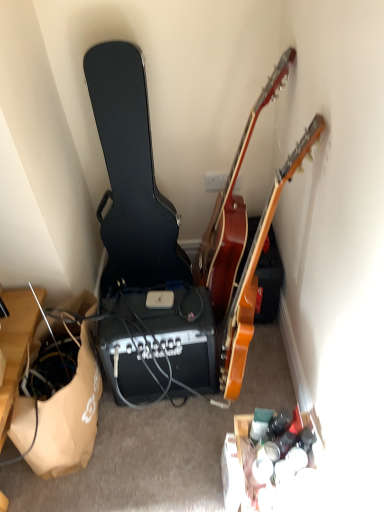
Question: Is glossy wood guitar at upper right, acting as the second guitar starting from the right, further to the viewer compared to brown paper bag at lower left?

Choices:
 (A) yes
 (B) no

Answer: (B)

Question: Could brown paper bag at lower left be considered to be inside glossy wood guitar at upper right, acting as the second guitar starting from the right?

Choices:
 (A) yes
 (B) no

Answer: (B)

Question: Is glossy wood guitar at upper right, which is counted as the 2th guitar, starting from the left, closer to camera compared to brown paper bag at lower left?

Choices:
 (A) no
 (B) yes

Answer: (B)

Question: From the image's perspective, does glossy wood guitar at upper right, which is counted as the 2th guitar, starting from the left, appear higher than brown paper bag at lower left?

Choices:
 (A) yes
 (B) no

Answer: (A)

Question: From a real-world perspective, is glossy wood guitar at upper right, which is counted as the 2th guitar, starting from the left, physically below brown paper bag at lower left?

Choices:
 (A) yes
 (B) no

Answer: (B)

Question: In terms of height, does wooden acoustic guitar at upper right, which ranks as the 1th guitar in right-to-left order, look taller or shorter compared to black hard case at left, which is the first guitar in left-to-right order?

Choices:
 (A) short
 (B) tall

Answer: (A)

Question: Is wooden acoustic guitar at upper right, which ranks as the 1th guitar in right-to-left order, inside or outside of black hard case at left, the 3th guitar viewed from the right?

Choices:
 (A) inside
 (B) outside

Answer: (B)

Question: Considering their positions, is wooden acoustic guitar at upper right, the third guitar viewed from the left, located in front of or behind black hard case at left, the 3th guitar viewed from the right?

Choices:
 (A) behind
 (B) front

Answer: (B)

Question: In the image, is wooden acoustic guitar at upper right, which ranks as the 1th guitar in right-to-left order, on the left side or the right side of black hard case at left, the 3th guitar viewed from the right?

Choices:
 (A) right
 (B) left

Answer: (A)

Question: In terms of height, does glossy wood guitar at upper right, acting as the second guitar starting from the right, look taller or shorter compared to black plastic speaker at center?

Choices:
 (A) short
 (B) tall

Answer: (B)

Question: From the image's perspective, is glossy wood guitar at upper right, which is counted as the 2th guitar, starting from the left, above or below black plastic speaker at center?

Choices:
 (A) below
 (B) above

Answer: (B)

Question: Does point (205, 236) appear closer or farther from the camera than point (200, 370)?

Choices:
 (A) closer
 (B) farther

Answer: (B)

Question: Would you say glossy wood guitar at upper right, acting as the second guitar starting from the right, is inside or outside black plastic speaker at center?

Choices:
 (A) inside
 (B) outside

Answer: (B)

Question: From their relative heights in the image, would you say brown paper bag at lower left is taller or shorter than black plastic speaker at center?

Choices:
 (A) tall
 (B) short

Answer: (A)

Question: Is brown paper bag at lower left bigger or smaller than black plastic speaker at center?

Choices:
 (A) small
 (B) big

Answer: (B)